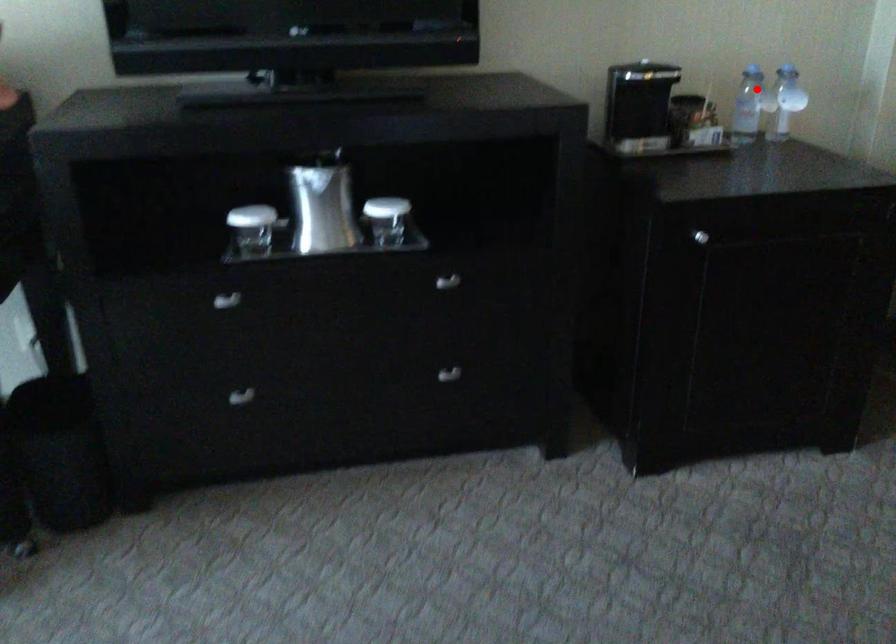
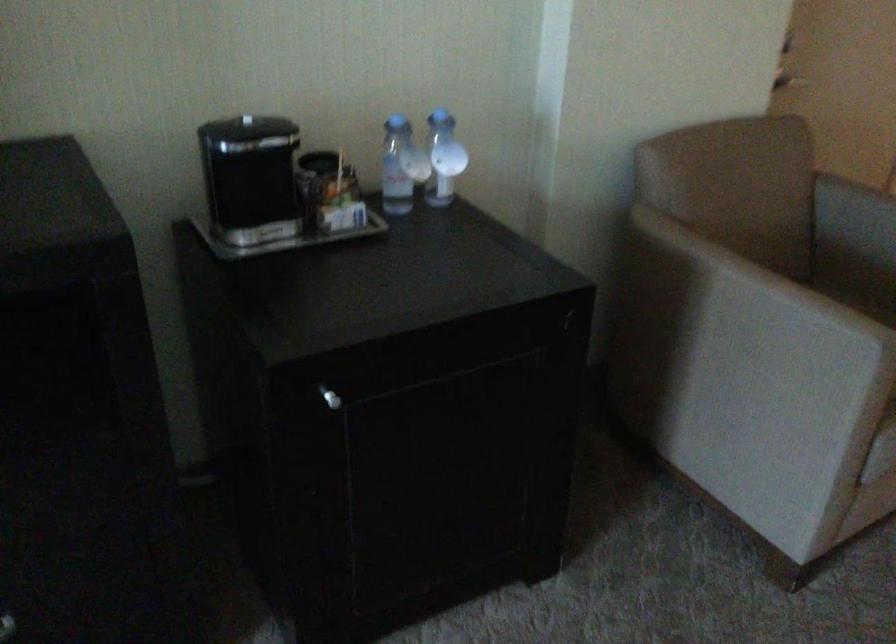
Question: I am providing you with two images of the same scene from different viewpoints. In image1, a red point is highlighted. Considering the same 3D point in image2, which of the following is correct?

Choices:
 (A) It is closer
 (B) It is farther

Answer: (A)